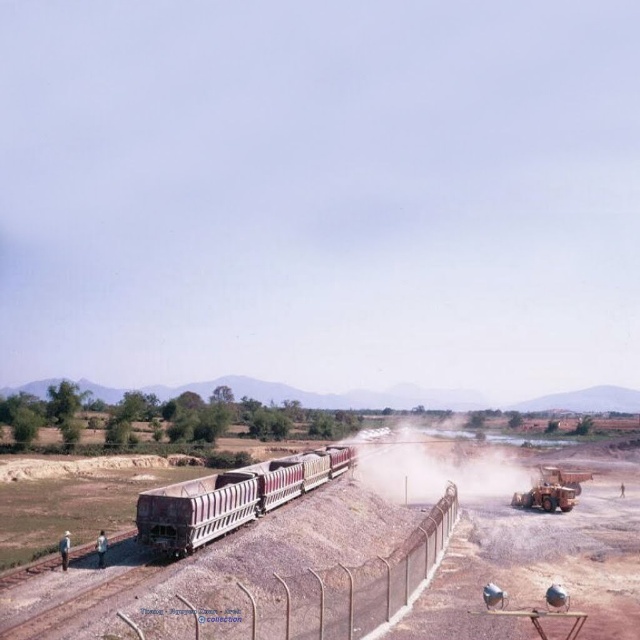
Question: Can you confirm if rusty metal train carriages at center is smaller than dusty yellow steam at center?

Choices:
 (A) yes
 (B) no

Answer: (A)

Question: Among these objects, which one is farthest from the camera?

Choices:
 (A) rusty metal train carriages at center
 (B) metallic wire fence at lower center
 (C) dusty yellow steam at center

Answer: (C)

Question: Is rusty metal train carriages at center to the right of dusty yellow steam at center from the viewer's perspective?

Choices:
 (A) no
 (B) yes

Answer: (A)

Question: Considering the real-world distances, which object is farthest from the dusty yellow steam at center?

Choices:
 (A) rusty metal train carriages at center
 (B) metallic wire fence at lower center

Answer: (B)

Question: Which point appears farthest from the camera in this image?

Choices:
 (A) [x=150, y=497]
 (B) [x=328, y=616]
 (C) [x=518, y=476]

Answer: (C)

Question: Is metallic wire fence at lower center below dusty yellow steam at center?

Choices:
 (A) yes
 (B) no

Answer: (B)